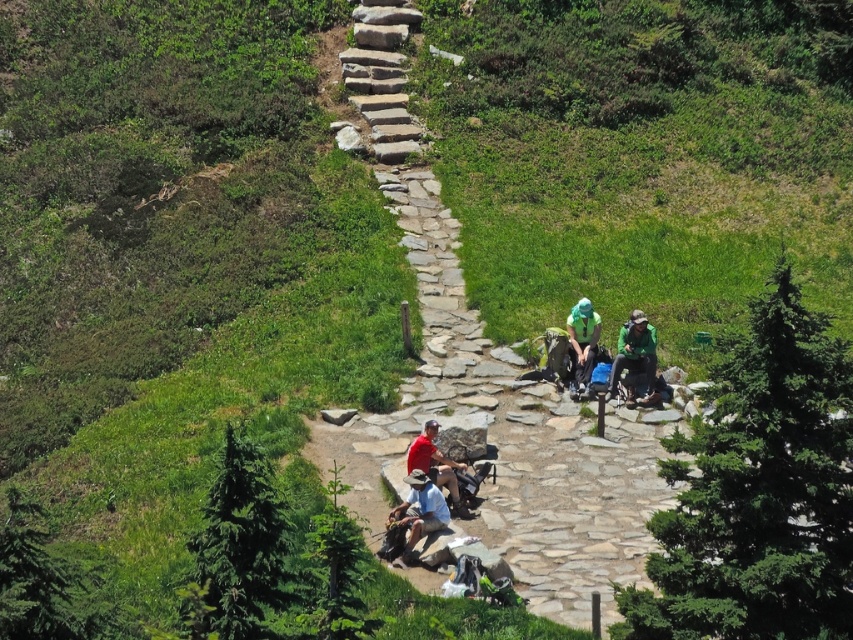
Which is in front, point (589, 378) or point (447, 480)?

Point (447, 480) is more forward.

Can you confirm if green fabric backpack at center is positioned above red fabric shirt at center?

Yes, green fabric backpack at center is above red fabric shirt at center.

This screenshot has height=640, width=853. In order to click on green fabric backpack at center in this screenshot , I will do `click(582, 342)`.

Where is `green fabric backpack at center`? The image size is (853, 640). green fabric backpack at center is located at coordinates (582, 342).

Can you confirm if green textured pine at lower left is positioned below light blue denim shorts at center?

No, green textured pine at lower left is not below light blue denim shorts at center.

Between point (276, 528) and point (426, 490), which one is positioned in front?

Point (276, 528) is in front.

Where is `green textured pine at lower left`? The width and height of the screenshot is (853, 640). green textured pine at lower left is located at coordinates (239, 547).

In the scene shown: Who is shorter, green textured pine at right or red fabric shirt at center?

red fabric shirt at center is shorter.

Is point (640, 605) closer to camera compared to point (426, 440)?

Yes, it is.

Describe the element at coordinates (759, 492) in the screenshot. The height and width of the screenshot is (640, 853). I see `green textured pine at right` at that location.

The height and width of the screenshot is (640, 853). What are the coordinates of `green textured pine at right` in the screenshot? It's located at (759, 492).